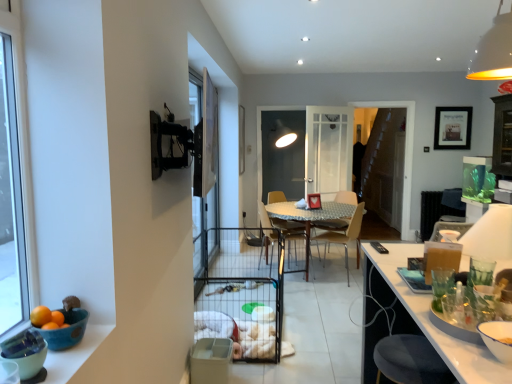
Describe the element at coordinates (25, 352) in the screenshot. I see `green matte bowl at lower left, which is counted as the 1th bowl, starting from the front` at that location.

The image size is (512, 384). In order to click on blue ceramic bowl at lower left, which is the second bowl in front-to-back order in this screenshot , I will do `click(66, 330)`.

Measure the distance between point (212, 121) and camera.

Point (212, 121) and camera are 3.41 meters apart from each other.

Locate an element on the screen. The height and width of the screenshot is (384, 512). clear glass screen door at center, arranged as the second screen door when viewed from the back is located at coordinates (204, 168).

I want to click on yellow matte lampshade at upper right, so click(x=494, y=51).

From a real-world perspective, is blue ceramic bowl at lower left, which is the second bowl in front-to-back order, positioned above or below wooden chair at center?

In terms of real-world spatial position, blue ceramic bowl at lower left, which is the second bowl in front-to-back order, is above wooden chair at center.

Which is behind, point (46, 340) or point (339, 221)?

The point (339, 221) is farther from the camera.

Is blue ceramic bowl at lower left, the first bowl positioned from the back, oriented towards wooden chair at center?

No, blue ceramic bowl at lower left, the first bowl positioned from the back, does not turn towards wooden chair at center.

Does blue ceramic bowl at lower left, which is the second bowl in front-to-back order, appear on the left side of wooden chair at center?

Correct, you'll find blue ceramic bowl at lower left, which is the second bowl in front-to-back order, to the left of wooden chair at center.

Could orange matte at left be considered to be inside blue ceramic bowl at lower left, which is the second bowl in front-to-back order?

No, orange matte at left is not surrounded by blue ceramic bowl at lower left, which is the second bowl in front-to-back order.

Image resolution: width=512 pixels, height=384 pixels. Find the location of `orange behind the blue ceramic bowl at lower left, which is the second bowl in front-to-back order`. orange behind the blue ceramic bowl at lower left, which is the second bowl in front-to-back order is located at coordinates (40, 316).

Which of these two, blue ceramic bowl at lower left, the first bowl positioned from the back, or orange matte at left, is thinner?

orange matte at left.

From the image's perspective, is blue ceramic bowl at lower left, the first bowl positioned from the back, located above orange matte at left?

No, from the image's perspective, blue ceramic bowl at lower left, the first bowl positioned from the back, is not on top of orange matte at left.

Considering the relative sizes of wooden chair at center and orange matte at left in the image provided, is wooden chair at center wider than orange matte at left?

Correct, the width of wooden chair at center exceeds that of orange matte at left.

How many degrees apart are the facing directions of wooden chair at center and orange matte at left?

wooden chair at center and orange matte at left are facing 124 degrees away from each other.

Is wooden chair at center not inside orange matte at left?

wooden chair at center is positioned outside orange matte at left.

From a real-world perspective, does wooden chair at center sit lower than orange matte at left?

Indeed, from a real-world perspective, wooden chair at center is positioned beneath orange matte at left.

From the image's perspective, which is above, metallic silver table at center or wooden chair at center?

wooden chair at center, from the image's perspective.

Consider the image. From their relative heights in the image, would you say metallic silver table at center is taller or shorter than wooden chair at center?

In the image, metallic silver table at center appears to be shorter than wooden chair at center.

Between metallic silver table at center and wooden chair at center, which one appears on the right side from the viewer's perspective?

wooden chair at center is more to the right.

Considering the positions of points (196, 98) and (352, 194), is point (196, 98) closer to camera compared to point (352, 194)?

Yes.

From a real-world perspective, is clear glass screen door at center, arranged as the second screen door when viewed from the back, above or below wooden chair at center?

In terms of real-world spatial position, clear glass screen door at center, arranged as the second screen door when viewed from the back, is above wooden chair at center.

Considering the relative positions of clear glass screen door at center, arranged as the second screen door when viewed from the back, and wooden chair at center in the image provided, is clear glass screen door at center, arranged as the second screen door when viewed from the back, to the right of wooden chair at center from the viewer's perspective?

No.

Are clear glass screen door at center, arranged as the second screen door when viewed from the back, and wooden chair at center beside each other?

No.

Is wooden framed picture at upper right looking in the opposite direction of wooden chair at center, which is the first chair from left to right?

No, wooden framed picture at upper right's orientation is not away from wooden chair at center, which is the first chair from left to right.

Looking at this image, considering the sizes of objects wooden framed picture at upper right and wooden chair at center, which is the first chair from left to right, in the image provided, who is bigger, wooden framed picture at upper right or wooden chair at center, which is the first chair from left to right,?

With larger size is wooden chair at center, which is the first chair from left to right.

From their relative heights in the image, would you say wooden framed picture at upper right is taller or shorter than wooden chair at center, which is counted as the first chair, starting from the back?

Considering their sizes, wooden framed picture at upper right has less height than wooden chair at center, which is counted as the first chair, starting from the back.

Can you confirm if wooden framed picture at upper right is wider than wooden chair at center, which is the first chair from left to right?

Incorrect, the width of wooden framed picture at upper right does not surpass that of wooden chair at center, which is the first chair from left to right.

Can you confirm if metallic silver table at center is positioned to the left of light brown wood chair at center, which appears as the 1th chair when viewed from the front?

Correct, you'll find metallic silver table at center to the left of light brown wood chair at center, which appears as the 1th chair when viewed from the front.

Are metallic silver table at center and light brown wood chair at center, acting as the first chair starting from the right, beside each other?

No, metallic silver table at center is not beside light brown wood chair at center, acting as the first chair starting from the right.

From the image's perspective, does metallic silver table at center appear higher than light brown wood chair at center, which appears as the 1th chair when viewed from the front?

Yes, from the image's perspective, metallic silver table at center is on top of light brown wood chair at center, which appears as the 1th chair when viewed from the front.

Find the location of `armchair below the blue ceramic bowl at lower left, which is the second bowl in front-to-back order (from a real-world perspective)`. armchair below the blue ceramic bowl at lower left, which is the second bowl in front-to-back order (from a real-world perspective) is located at coordinates tap(332, 224).

Where is `the 1st bowl below when counting from the orange matte at left (from the image's perspective)`? the 1st bowl below when counting from the orange matte at left (from the image's perspective) is located at coordinates (66, 330).

From the image, which object appears to be nearer to wooden framed picture at upper right, yellow matte lampshade at upper right or wooden chair at center, which is counted as the 2th chair, starting from the right?

wooden chair at center, which is counted as the 2th chair, starting from the right, is positioned closer to the anchor wooden framed picture at upper right.

Based on their spatial positions, is orange matte at left or wooden chair at center further from yellow matte lampshade at upper right?

wooden chair at center.

From the image, which object appears to be farther from orange matte at left, wooden chair at center, which is counted as the first chair, starting from the back, or wooden chair at center?

wooden chair at center.

Estimate the real-world distances between objects in this image. Which object is further from wooden framed picture at upper right, green matte bowl at lower left, which is the 2th bowl from back to front, or transparent glass screen door at center, marked as the second screen door in a left-to-right arrangement?

Based on the image, green matte bowl at lower left, which is the 2th bowl from back to front, appears to be further to wooden framed picture at upper right.

Estimate the real-world distances between objects in this image. Which object is closer to wooden chair at center, light brown wood chair at center, which ranks as the 2th chair in left-to-right order, or wooden chair at center, which is the second chair from front to back?

Based on the image, light brown wood chair at center, which ranks as the 2th chair in left-to-right order, appears to be nearer to wooden chair at center.

Looking at the image, which one is located further to wooden framed picture at upper right, yellow matte lampshade at upper right or wooden chair at center?

yellow matte lampshade at upper right is further to wooden framed picture at upper right.

From the image, which object appears to be farther from blue ceramic bowl at lower left, which is the second bowl in front-to-back order, wooden chair at center, which is the first chair from left to right, or green matte bowl at lower left, which is the 2th bowl from back to front?

Among the two, wooden chair at center, which is the first chair from left to right, is located further to blue ceramic bowl at lower left, which is the second bowl in front-to-back order.

Estimate the real-world distances between objects in this image. Which object is closer to orange matte at left, clear glass screen door at center, positioned as the first screen door in front-to-back order, or wooden chair at center?

clear glass screen door at center, positioned as the first screen door in front-to-back order.

Locate an element on the screen. This screenshot has height=384, width=512. chair between clear glass screen door at center, positioned as the first screen door in front-to-back order, and transparent glass screen door at center, the second screen door when ordered from front to back, along the z-axis is located at coordinates (281, 229).

Find the location of `table positioned between orange matte at left and wooden chair at center from near to far`. table positioned between orange matte at left and wooden chair at center from near to far is located at coordinates (310, 219).

This screenshot has height=384, width=512. Identify the location of light fixture between orange matte at left and wooden framed picture at upper right from front to back. (494, 51).

I want to click on table between orange matte at left and transparent glass screen door at center, marked as the second screen door in a left-to-right arrangement, from front to back, so click(x=310, y=219).